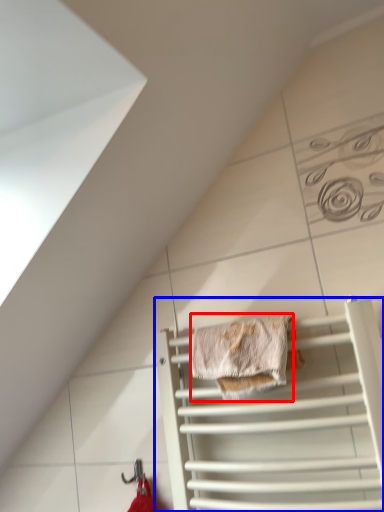
Question: Which object appears closest to the camera in this image, material (highlighted by a red box) or cage (highlighted by a blue box)?

Choices:
 (A) material
 (B) cage

Answer: (B)